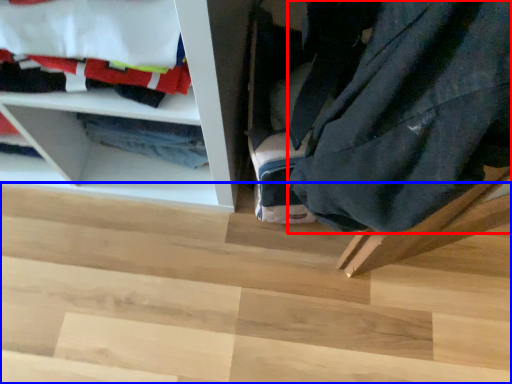
Question: Among these objects, which one is farthest to the camera, clothing (highlighted by a red box) or stair (highlighted by a blue box)?

Choices:
 (A) clothing
 (B) stair

Answer: (B)